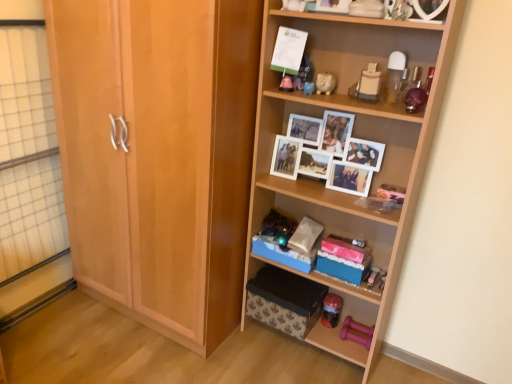
Question: From the image's perspective, is matte plastic toy at upper center, arranged as the 3th toy when viewed from the top, above transparent glass door at left?

Choices:
 (A) yes
 (B) no

Answer: (A)

Question: Is matte plastic toy at upper center, arranged as the 3th toy when viewed from the top, with transparent glass door at left?

Choices:
 (A) yes
 (B) no

Answer: (B)

Question: Does matte plastic toy at upper center, the 5th toy when ordered from bottom to top, have a greater width compared to transparent glass door at left?

Choices:
 (A) no
 (B) yes

Answer: (B)

Question: Is matte plastic toy at upper center, arranged as the 3th toy when viewed from the top, in front of transparent glass door at left?

Choices:
 (A) no
 (B) yes

Answer: (A)

Question: Is matte plastic toy at upper center, the 5th toy when ordered from bottom to top, taller than transparent glass door at left?

Choices:
 (A) no
 (B) yes

Answer: (A)

Question: In terms of height, does light brown wood cabinet at left look taller or shorter compared to matte pink piggy bank at upper center, positioned as the fourth toy in bottom-to-top order?

Choices:
 (A) tall
 (B) short

Answer: (A)

Question: Considering their positions, is light brown wood cabinet at left located in front of or behind matte pink piggy bank at upper center, which is counted as the 4th toy, starting from the top?

Choices:
 (A) front
 (B) behind

Answer: (A)

Question: In terms of width, does light brown wood cabinet at left look wider or thinner when compared to matte pink piggy bank at upper center, positioned as the fourth toy in bottom-to-top order?

Choices:
 (A) thin
 (B) wide

Answer: (B)

Question: From a real-world perspective, is light brown wood cabinet at left positioned above or below matte pink piggy bank at upper center, positioned as the fourth toy in bottom-to-top order?

Choices:
 (A) below
 (B) above

Answer: (A)

Question: Considering the positions of rubber pink dumbbell at lower right, positioned as the 5th toy in top-to-bottom order, and white paper at upper center in the image, is rubber pink dumbbell at lower right, positioned as the 5th toy in top-to-bottom order, bigger or smaller than white paper at upper center?

Choices:
 (A) big
 (B) small

Answer: (B)

Question: Considering their positions, is rubber pink dumbbell at lower right, positioned as the 5th toy in top-to-bottom order, located in front of or behind white paper at upper center?

Choices:
 (A) behind
 (B) front

Answer: (A)

Question: Is rubber pink dumbbell at lower right, the third toy positioned from the bottom, taller or shorter than white paper at upper center?

Choices:
 (A) short
 (B) tall

Answer: (A)

Question: Do you think rubber pink dumbbell at lower right, the third toy positioned from the bottom, is within white paper at upper center, or outside of it?

Choices:
 (A) outside
 (B) inside

Answer: (A)

Question: Considering their positions, is white paper at upper center located in front of or behind matte plastic toy at upper center, arranged as the 3th toy when viewed from the top?

Choices:
 (A) behind
 (B) front

Answer: (A)

Question: Is point (290, 48) closer or farther from the camera than point (367, 69)?

Choices:
 (A) closer
 (B) farther

Answer: (B)